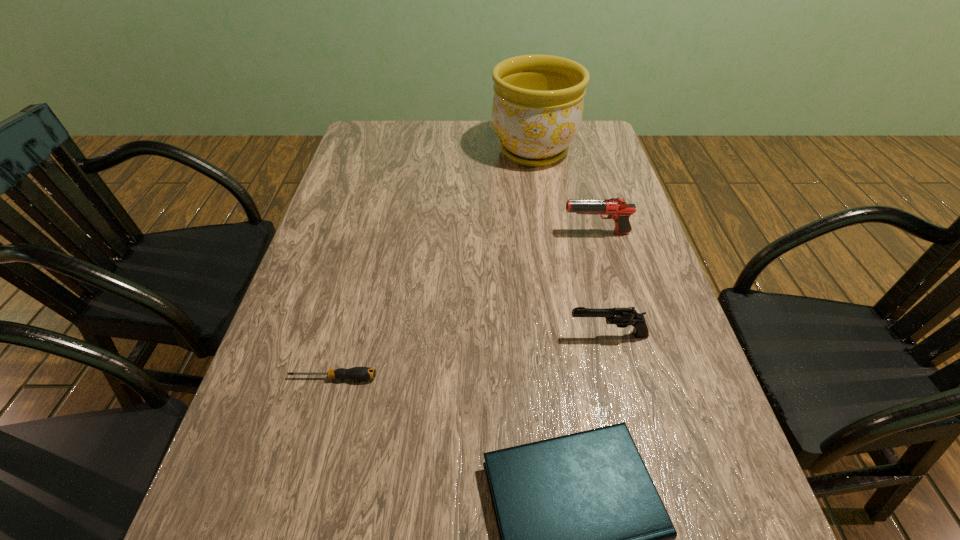
Where is `blank space located at the aiming end of the second tallest object`? blank space located at the aiming end of the second tallest object is located at coordinates (532, 233).

Locate an element on the screen. Image resolution: width=960 pixels, height=540 pixels. free location located at the aiming end of the second tallest object is located at coordinates (540, 233).

Identify the location of free space located at the end of the barrel of the shorter gun. This screenshot has height=540, width=960. (510, 335).

Locate an element on the screen. The width and height of the screenshot is (960, 540). free space located 0.350m at the end of the barrel of the shorter gun is located at coordinates (399, 335).

Where is `free space located at the end of the barrel of the shorter gun`? The width and height of the screenshot is (960, 540). free space located at the end of the barrel of the shorter gun is located at coordinates (414, 335).

You are a GUI agent. You are given a task and a screenshot of the screen. Output one action in this format:
    pyautogui.click(x=<x>, y=<y>)
    Task: Click on the vacant point located 0.350m on the back of the shortest object
    
    Given the screenshot: What is the action you would take?
    pyautogui.click(x=367, y=249)

Where is `object that is at the far edge`? object that is at the far edge is located at coordinates (537, 109).

Locate an element on the screen. The height and width of the screenshot is (540, 960). object located in the left edge section of the desktop is located at coordinates (356, 373).

Find the location of a particular element. The height and width of the screenshot is (540, 960). flowerpot present at the right edge is located at coordinates (537, 109).

The width and height of the screenshot is (960, 540). I want to click on object that is at the far right corner, so click(537, 109).